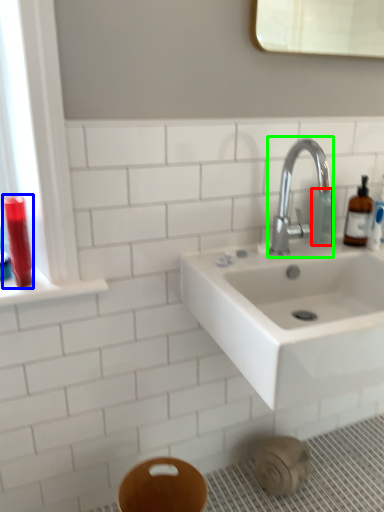
Question: Which object is the farthest from toiletry (highlighted by a red box)? Choose among these: mouthwash (highlighted by a blue box) or tap (highlighted by a green box).

Choices:
 (A) mouthwash
 (B) tap

Answer: (A)